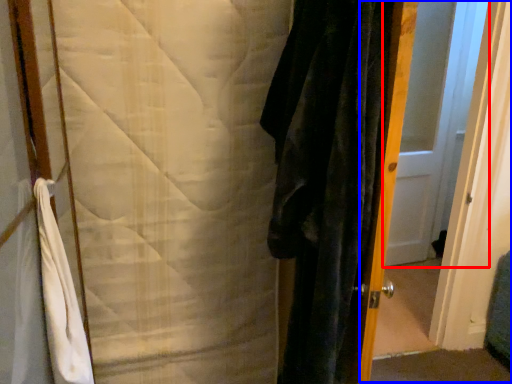
Question: Which object is closer to the camera taking this photo, door (highlighted by a red box) or screen door (highlighted by a blue box)?

Choices:
 (A) door
 (B) screen door

Answer: (B)